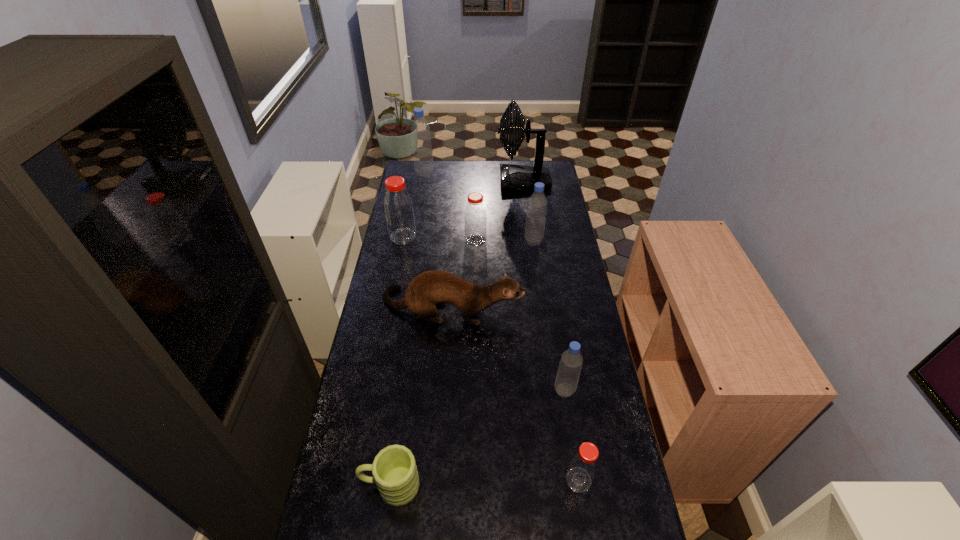
Where is `object that is at the far left corner`? The width and height of the screenshot is (960, 540). object that is at the far left corner is located at coordinates (420, 130).

This screenshot has width=960, height=540. Find the location of `object present at the far right corner`. object present at the far right corner is located at coordinates (513, 178).

This screenshot has width=960, height=540. In the image, there is a desktop. Find the location of `vacant space at the far edge`. vacant space at the far edge is located at coordinates (496, 181).

The width and height of the screenshot is (960, 540). In the image, there is a desktop. Identify the location of free region at the left edge. (413, 273).

This screenshot has width=960, height=540. What are the coordinates of `vacant space at the right edge of the desktop` in the screenshot? It's located at (580, 313).

The width and height of the screenshot is (960, 540). I want to click on empty space that is in between the fan and the nearest red bottle, so click(551, 330).

Where is `vacant space in between the eighth shortest object and the fan`? This screenshot has height=540, width=960. vacant space in between the eighth shortest object and the fan is located at coordinates (473, 177).

This screenshot has height=540, width=960. I want to click on unoccupied area between the tallest object and the farthest blue bottle, so [473, 177].

At what (x,y) coordinates should I click in order to perform the action: click on vacant space that is in between the second nearest blue bottle and the second biggest red bottle. Please return your answer as a coordinate pair (x, y). The image size is (960, 540). Looking at the image, I should click on (505, 240).

Locate an element on the screen. The image size is (960, 540). vacant region between the green mug and the eighth shortest object is located at coordinates (408, 329).